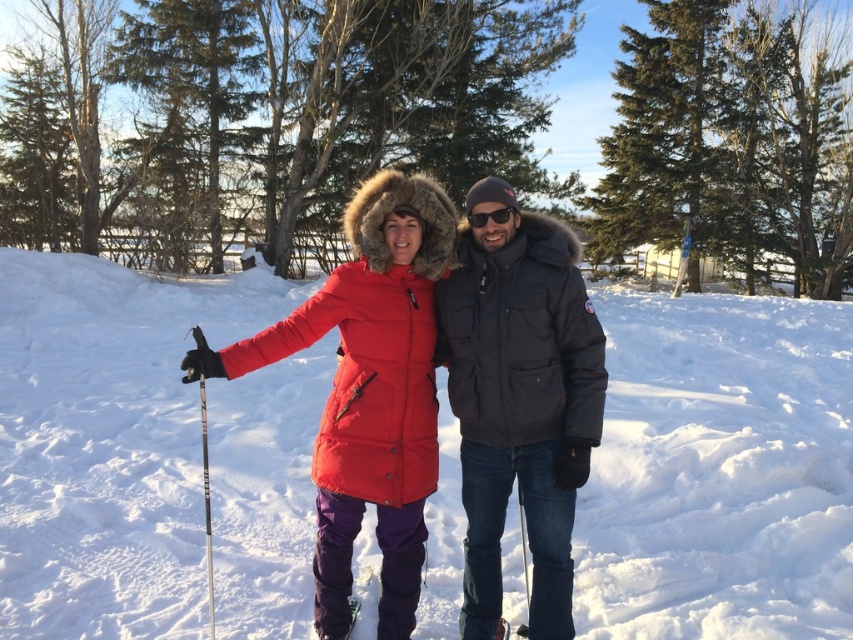
Does white fluffy snow at center have a smaller size compared to matte black jacket at center?

No.

Looking at this image, can you confirm if white fluffy snow at center is shorter than matte black jacket at center?

In fact, white fluffy snow at center may be taller than matte black jacket at center.

You are a GUI agent. You are given a task and a screenshot of the screen. Output one action in this format:
    pyautogui.click(x=<x>, y=<y>)
    Task: Click on the white fluffy snow at center
    This screenshot has height=640, width=853.
    Given the screenshot: What is the action you would take?
    pyautogui.click(x=718, y=470)

Locate an element on the screen. white fluffy snow at center is located at coordinates (718, 470).

Based on the photo, is the position of white plastic ski pole at left more distant than that of purple fabric ski at lower center?

No.

Is white plastic ski pole at left to the right of purple fabric ski at lower center from the viewer's perspective?

In fact, white plastic ski pole at left is to the left of purple fabric ski at lower center.

Is point (201, 428) positioned before point (358, 592)?

That is False.

The width and height of the screenshot is (853, 640). What are the coordinates of `white plastic ski pole at left` in the screenshot? It's located at (202, 442).

Which of these two, white plastic ski pole at left or black reflective sunglasses at center, stands shorter?

black reflective sunglasses at center is shorter.

Who is higher up, white plastic ski pole at left or black reflective sunglasses at center?

black reflective sunglasses at center

Is point (202, 362) farther from camera compared to point (482, 211)?

No, (202, 362) is in front of (482, 211).

At what (x,y) coordinates should I click in order to perform the action: click on white plastic ski pole at left. Please return your answer as a coordinate pair (x, y). Looking at the image, I should click on (202, 442).